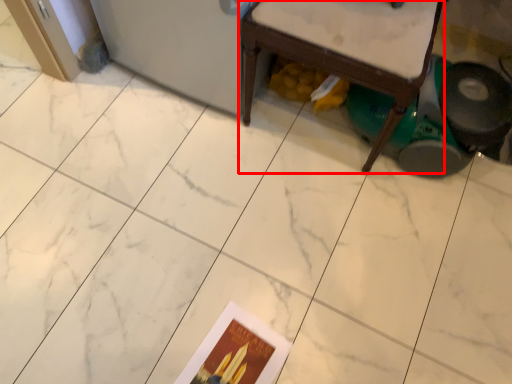
Question: From the image's perspective, considering the relative positions of furniture (annotated by the red box) and postcard in the image provided, where is furniture (annotated by the red box) located with respect to the staircase?

Choices:
 (A) above
 (B) below

Answer: (A)